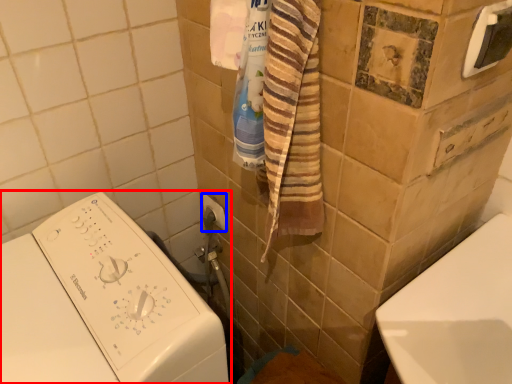
Question: Which object appears closest to the camera in this image, washing machine (highlighted by a red box) or towel bar (highlighted by a blue box)?

Choices:
 (A) washing machine
 (B) towel bar

Answer: (A)